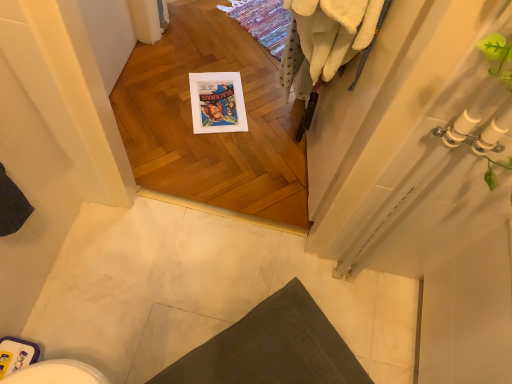
Find the location of a particular element. The width and height of the screenshot is (512, 384). free space to the back side of dark gray fabric bath mat at lower center is located at coordinates (270, 263).